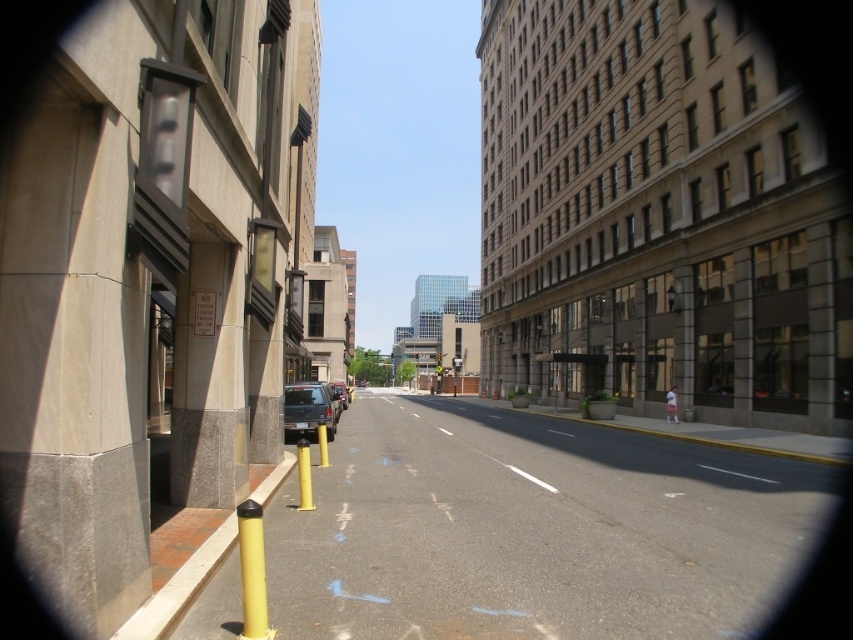
Question: Which object is closer to the camera taking this photo?

Choices:
 (A) matte black suv at center
 (B) yellow matte pole at center

Answer: (B)

Question: From the image, what is the correct spatial relationship of yellow matte pole at center in relation to matte black suv at center?

Choices:
 (A) below
 (B) above

Answer: (B)

Question: Observing the image, what is the correct spatial positioning of yellow asphalt at lower left in reference to yellow matte pole at lower left?

Choices:
 (A) below
 (B) above

Answer: (A)

Question: Which of the following is the farthest from the observer?

Choices:
 (A) (305, 499)
 (B) (321, 387)

Answer: (B)

Question: Which object is positioned farthest from the yellow asphalt at lower left?

Choices:
 (A) matte black suv at center
 (B) yellow matte pole at center
 (C) yellow rubber pole at center

Answer: (B)

Question: Is matte black suv at center above yellow rubber pole at center?

Choices:
 (A) yes
 (B) no

Answer: (B)